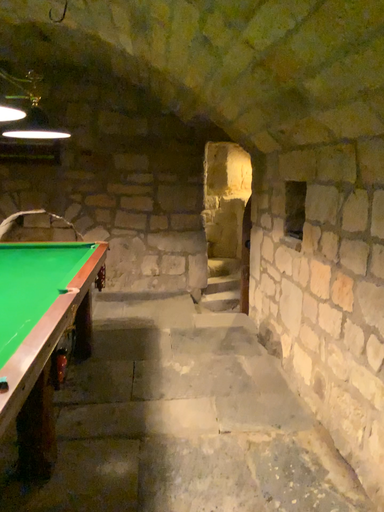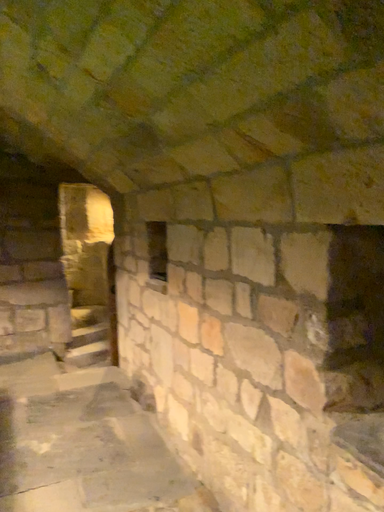
Question: How did the camera likely rotate when shooting the video?

Choices:
 (A) rotated upward
 (B) rotated downward

Answer: (A)